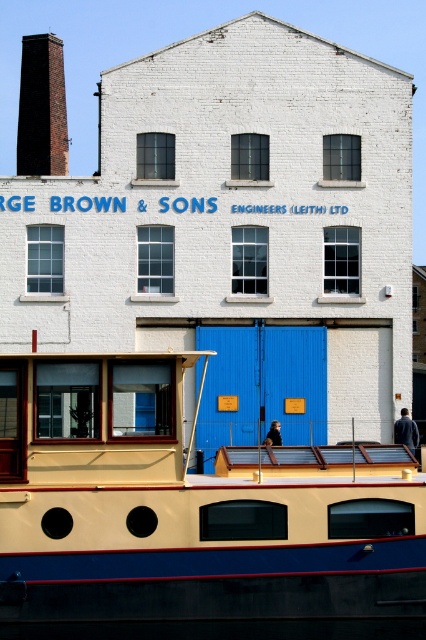
Is beige wood boat at center smaller than dark red brick chimney at upper left?

Indeed, beige wood boat at center has a smaller size compared to dark red brick chimney at upper left.

Which is behind, point (219, 513) or point (28, 129)?

The point (28, 129) is more distant.

Which is in front, point (379, 472) or point (66, 112)?

Point (379, 472) is in front.

Locate an element on the screen. beige wood boat at center is located at coordinates (189, 516).